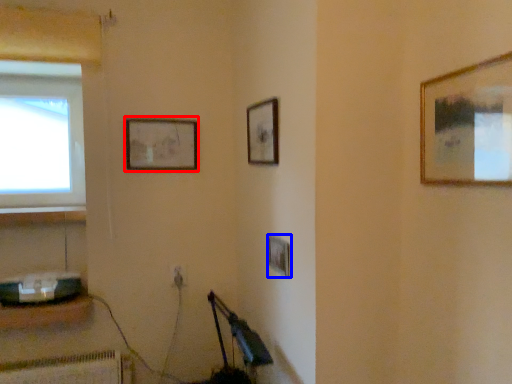
Question: Which object appears farthest to the camera in this image, picture frame (highlighted by a red box) or picture frame (highlighted by a blue box)?

Choices:
 (A) picture frame
 (B) picture frame

Answer: (A)